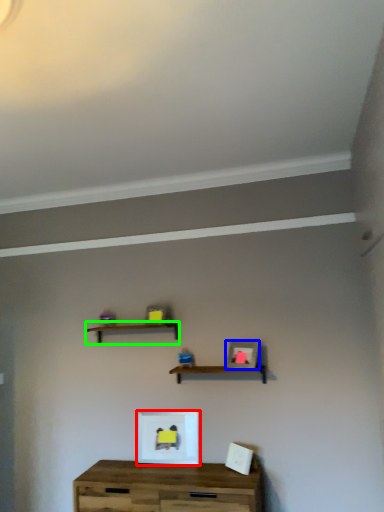
Question: Which object is the farthest from picture frame (highlighted by a red box)? Choose among these: picture frame (highlighted by a blue box) or shelf (highlighted by a green box).

Choices:
 (A) picture frame
 (B) shelf

Answer: (B)